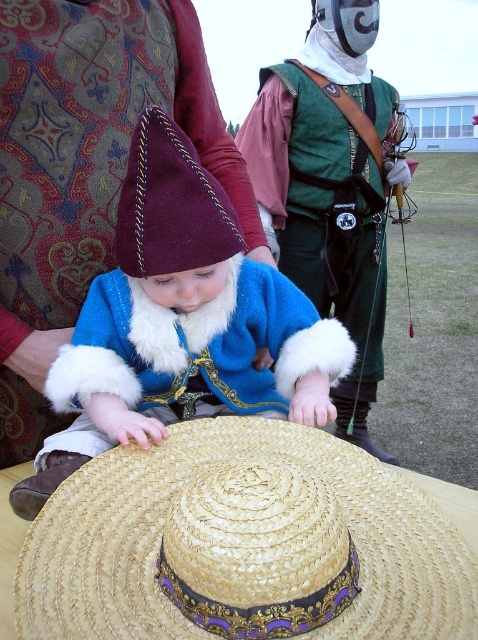
You are a knight in the medieval event and need to retrieve your natural straw hat at center. There is a green leather armor at center blocking your path. Can you reach your hat without moving the armor?

The natural straw hat at center is behind green leather armor at center, so you can reach it by going around the green leather armor at center to access the hat from the back side.

You are a guest at a medieval festival and notice two straw hats displayed on a table. The woven straw sombrero at center and the natural straw hat at center. Which one is positioned lower on the table?

The woven straw sombrero at center is positioned lower on the table since it is described as being below the natural straw hat at center.